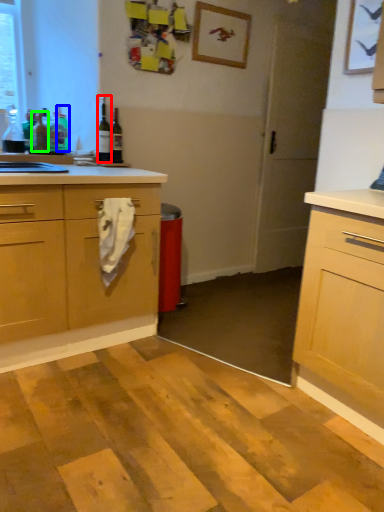
Question: Based on their relative distances, which object is farther from bottle (highlighted by a red box)? Choose from bottle (highlighted by a blue box) and bottle (highlighted by a green box).

Choices:
 (A) bottle
 (B) bottle

Answer: (B)